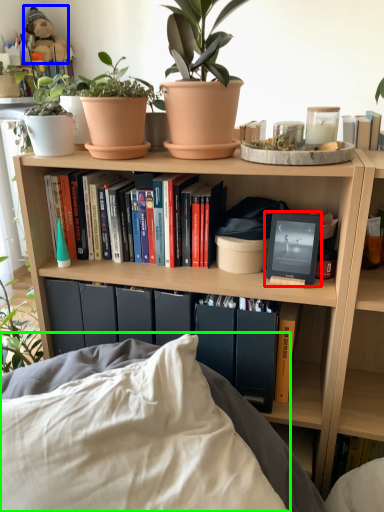
Question: Which object is positioned closest to picture frame (highlighted by a red box)? Select from toy (highlighted by a blue box) and pillow (highlighted by a green box).

Choices:
 (A) toy
 (B) pillow

Answer: (B)